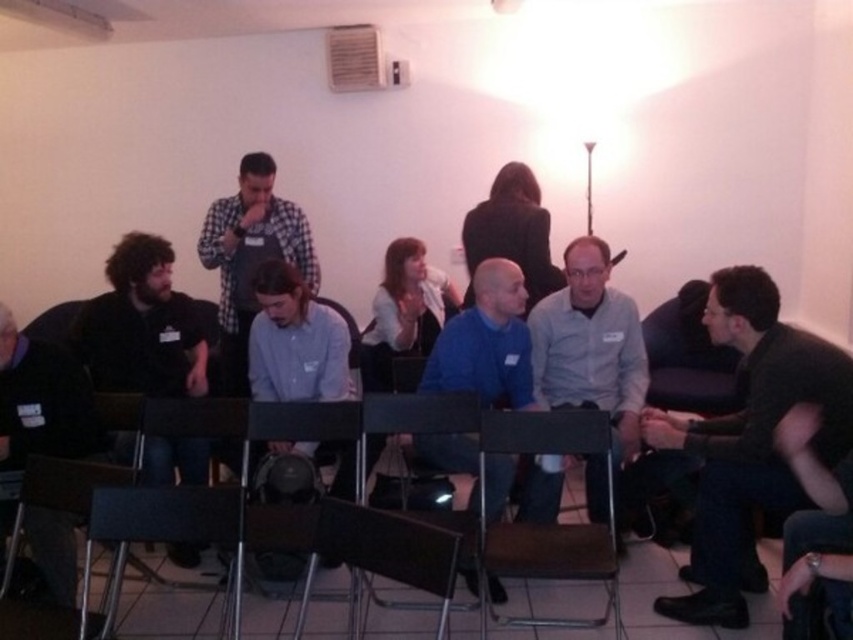
Question: Can you confirm if black matte shirt at left is bigger than white plastic speaker at upper center?

Choices:
 (A) yes
 (B) no

Answer: (A)

Question: Can you confirm if blue matte shirt at center is positioned below black fabric shirt at left?

Choices:
 (A) yes
 (B) no

Answer: (B)

Question: Among these objects, which one is farthest from the camera?

Choices:
 (A) black matte shirt at left
 (B) matte black chair at lower left
 (C) white plastic speaker at upper center
 (D) metallic gray chair at center

Answer: (C)

Question: Is black matte shirt at left thinner than metallic gray chair at center?

Choices:
 (A) no
 (B) yes

Answer: (A)

Question: Estimate the real-world distances between objects in this image. Which object is closer to the matte black chair at lower left?

Choices:
 (A) blue matte shirt at center
 (B) brown fabric chair at center
 (C) gray matte shirt at center

Answer: (B)

Question: Which point is farther from the camera taking this photo?

Choices:
 (A) (416, 524)
 (B) (483, 241)
 (C) (111, 273)

Answer: (B)